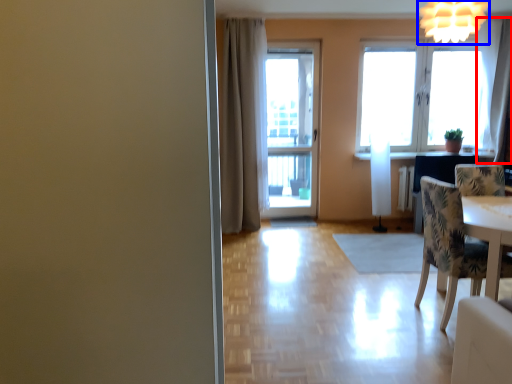
Question: Which point is further to the camera, curtain (highlighted by a red box) or light fixture (highlighted by a blue box)?

Choices:
 (A) curtain
 (B) light fixture

Answer: (A)